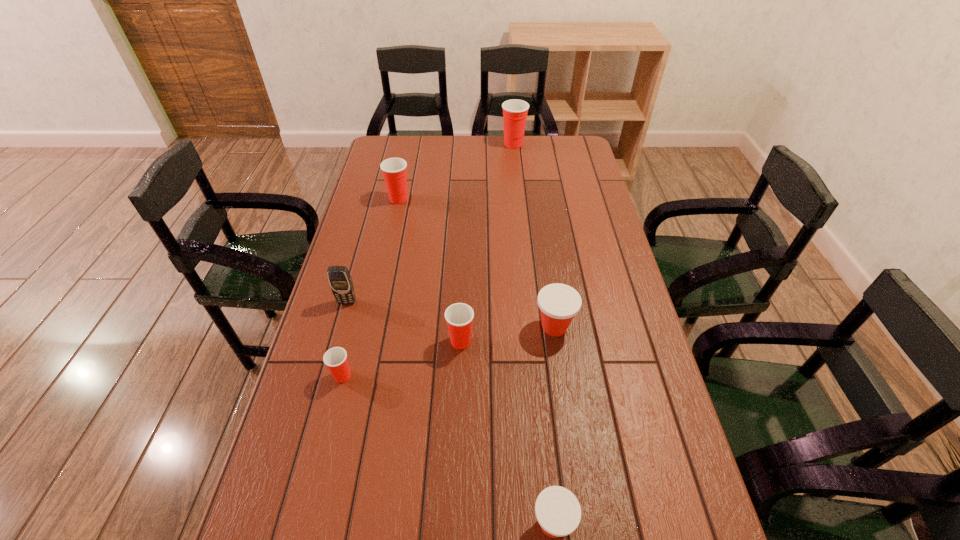
Locate an element on the screen. This screenshot has height=540, width=960. the tallest Dixie cup is located at coordinates (515, 111).

Where is `the farthest Dixie cup`? This screenshot has height=540, width=960. the farthest Dixie cup is located at coordinates (515, 111).

Where is `the sixth nearest object`? the sixth nearest object is located at coordinates (394, 170).

I want to click on the fifth nearest Dixie cup, so click(x=394, y=170).

The image size is (960, 540). Find the location of `the fifth nearest object`. the fifth nearest object is located at coordinates (340, 280).

Find the location of a particular element. the second smallest red Dixie cup is located at coordinates coord(459,316).

Identify the location of the second red Dixie cup from right to left. (459, 316).

Image resolution: width=960 pixels, height=540 pixels. Identify the location of the bigger red-orange Dixie cup. (559, 303).

Locate an element on the screen. Image resolution: width=960 pixels, height=540 pixels. the smallest red Dixie cup is located at coordinates (335, 358).

Locate an element on the screen. the fifth farthest Dixie cup is located at coordinates (335, 358).